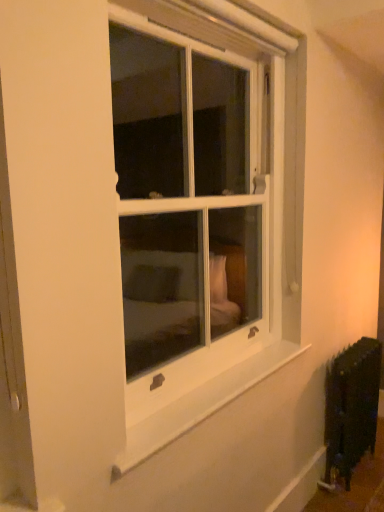
Question: Is white smooth window sill at lower center facing towards white glass window at center?

Choices:
 (A) yes
 (B) no

Answer: (B)

Question: Can you confirm if white smooth window sill at lower center is wider than white glass window at center?

Choices:
 (A) yes
 (B) no

Answer: (B)

Question: Could white glass window at center be considered to be inside white smooth window sill at lower center?

Choices:
 (A) no
 (B) yes

Answer: (A)

Question: Considering the relative sizes of white smooth window sill at lower center and white glass window at center in the image provided, is white smooth window sill at lower center shorter than white glass window at center?

Choices:
 (A) yes
 (B) no

Answer: (A)

Question: Can you confirm if white smooth window sill at lower center is thinner than white glass window at center?

Choices:
 (A) no
 (B) yes

Answer: (B)

Question: Considering the relative sizes of white smooth window sill at lower center and white glass window at center in the image provided, is white smooth window sill at lower center taller than white glass window at center?

Choices:
 (A) yes
 (B) no

Answer: (B)

Question: From the image's perspective, is white glass window at center on top of black matte radiator at lower right?

Choices:
 (A) yes
 (B) no

Answer: (A)

Question: Does white glass window at center have a lesser width compared to black matte radiator at lower right?

Choices:
 (A) yes
 (B) no

Answer: (B)

Question: Does white glass window at center appear on the left side of black matte radiator at lower right?

Choices:
 (A) yes
 (B) no

Answer: (A)

Question: From a real-world perspective, is white glass window at center beneath black matte radiator at lower right?

Choices:
 (A) no
 (B) yes

Answer: (A)

Question: Is white glass window at center in front of black matte radiator at lower right?

Choices:
 (A) no
 (B) yes

Answer: (B)

Question: Does white glass window at center have a larger size compared to black matte radiator at lower right?

Choices:
 (A) yes
 (B) no

Answer: (A)

Question: Is black matte radiator at lower right next to white glass window at center?

Choices:
 (A) no
 (B) yes

Answer: (A)